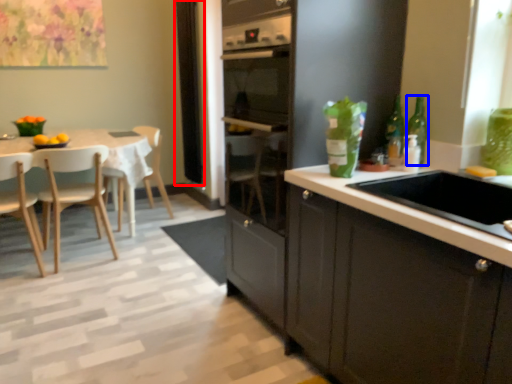
Question: Which object is closer to the camera taking this photo, window screen (highlighted by a red box) or bottle (highlighted by a blue box)?

Choices:
 (A) window screen
 (B) bottle

Answer: (B)